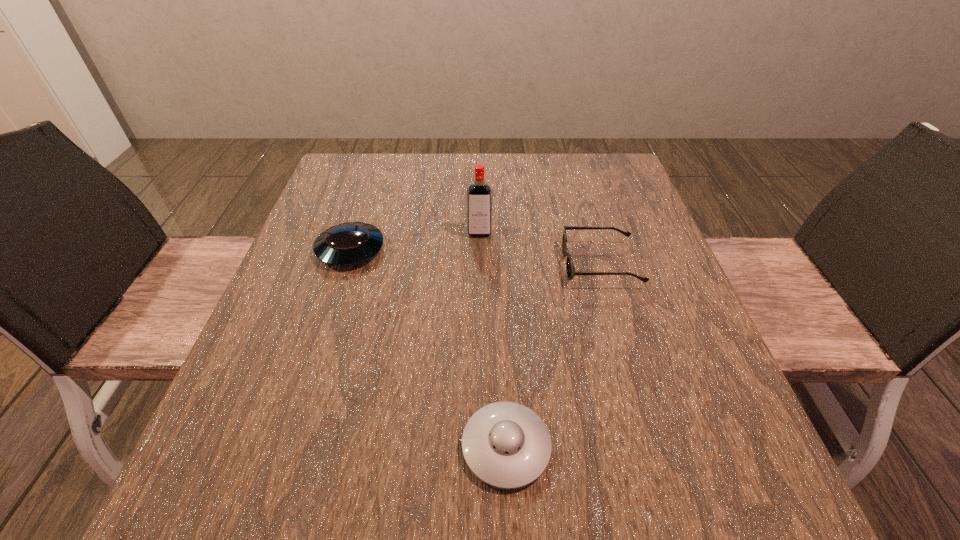
You are a GUI agent. You are given a task and a screenshot of the screen. Output one action in this format:
    pyautogui.click(x=<x>, y=<y>)
    Task: Click on the vacant space located 0.080m on the front lenses of the rightmost object
    
    Given the screenshot: What is the action you would take?
    pos(527,265)

Locate an element on the screen. The image size is (960, 540). vacant area situated 0.170m on the left of the shortest object is located at coordinates (348, 447).

Where is `object situated at the near edge`? This screenshot has width=960, height=540. object situated at the near edge is located at coordinates (506, 445).

Image resolution: width=960 pixels, height=540 pixels. Find the location of `object positioned at the left edge`. object positioned at the left edge is located at coordinates [x=351, y=243].

Where is `object that is positioned at the right edge`? The height and width of the screenshot is (540, 960). object that is positioned at the right edge is located at coordinates (570, 270).

In the image, there is a desktop. Find the location of `vacant space at the far edge`. vacant space at the far edge is located at coordinates (450, 158).

Identify the location of free space at the near edge. (404, 526).

Identify the location of vacant space at the left edge. (222, 430).

Image resolution: width=960 pixels, height=540 pixels. I want to click on free space at the right edge of the desktop, so click(752, 442).

At what (x,y) coordinates should I click in order to perform the action: click on vacant space at the far left corner of the desktop. Please return your answer as a coordinate pair (x, y). Looking at the image, I should click on 378,185.